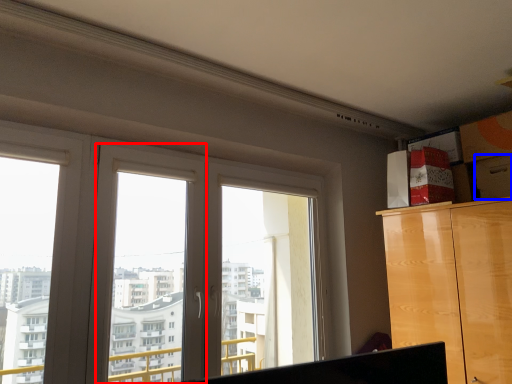
Question: Which object appears farthest to the camera in this image, window frame (highlighted by a red box) or drawer (highlighted by a blue box)?

Choices:
 (A) window frame
 (B) drawer

Answer: (B)